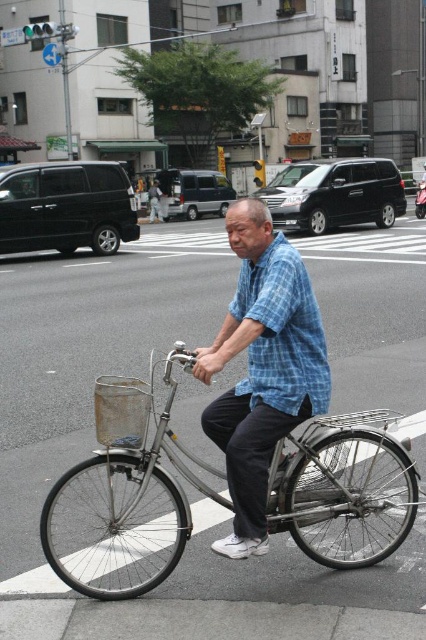
Question: Which of the following is the farthest from the observer?

Choices:
 (A) silver metallic bicycle at center
 (B) blue plaid shirt at center

Answer: (B)

Question: Observing the image, what is the correct spatial positioning of silver metallic bicycle at center in reference to blue plaid shirt at center?

Choices:
 (A) right
 (B) left

Answer: (B)

Question: Can you confirm if silver metallic bicycle at center is smaller than blue plaid shirt at center?

Choices:
 (A) yes
 (B) no

Answer: (B)

Question: Which point is closer to the camera?

Choices:
 (A) (137, 422)
 (B) (302, 394)

Answer: (A)

Question: Observing the image, what is the correct spatial positioning of silver metallic bicycle at center in reference to blue plaid shirt at center?

Choices:
 (A) above
 (B) below

Answer: (B)